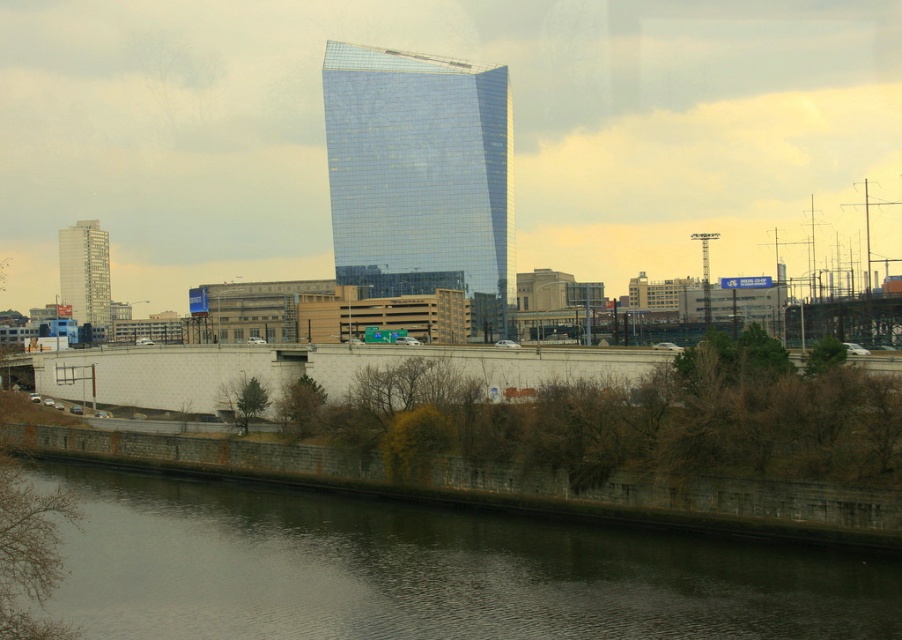
Question: Which point is farther to the camera?

Choices:
 (A) glossy glass skyscraper at center
 (B) dark gray concrete wall at lower center
 (C) matte gray building at left

Answer: (A)

Question: Which point is closer to the camera?

Choices:
 (A) (192, 502)
 (B) (85, 285)
 (C) (471, 144)

Answer: (A)

Question: Is dark gray concrete wall at lower center further to the viewer compared to glossy glass skyscraper at center?

Choices:
 (A) no
 (B) yes

Answer: (A)

Question: Which point appears farthest from the camera in this image?

Choices:
 (A) (63, 269)
 (B) (336, 528)
 (C) (394, 246)

Answer: (A)

Question: Is the position of dark gray concrete wall at lower center less distant than that of glossy glass skyscraper at center?

Choices:
 (A) yes
 (B) no

Answer: (A)

Question: Can you confirm if dark gray concrete wall at lower center is positioned to the right of matte gray building at left?

Choices:
 (A) yes
 (B) no

Answer: (A)